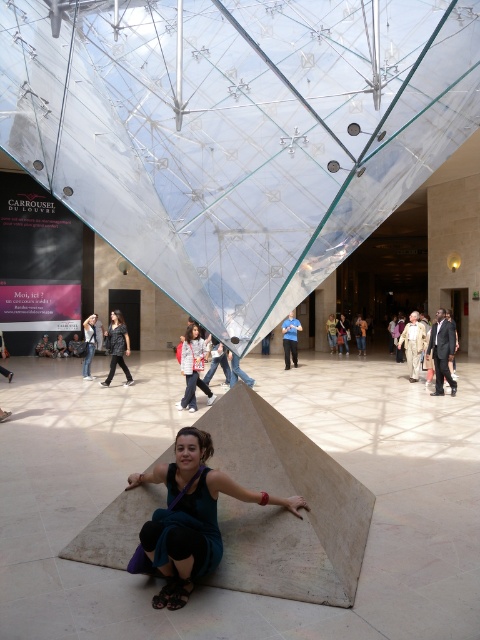
Question: Can you confirm if teal fabric dress at center is thinner than leather jacket at center?

Choices:
 (A) yes
 (B) no

Answer: (B)

Question: Among these points, which one is nearest to the camera?

Choices:
 (A) (192, 387)
 (B) (291, 512)
 (C) (113, 349)

Answer: (B)

Question: Which point is farther from the camera taking this photo?

Choices:
 (A) (194, 332)
 (B) (128, 340)

Answer: (B)

Question: Is teal fabric dress at center closer to camera compared to blue shirt at center?

Choices:
 (A) no
 (B) yes

Answer: (B)

Question: Does teal fabric dress at center appear on the right side of blue shirt at center?

Choices:
 (A) no
 (B) yes

Answer: (A)

Question: Which of these objects is positioned farthest from the blue shirt at center?

Choices:
 (A) leather jacket at center
 (B) teal fabric dress at center

Answer: (B)